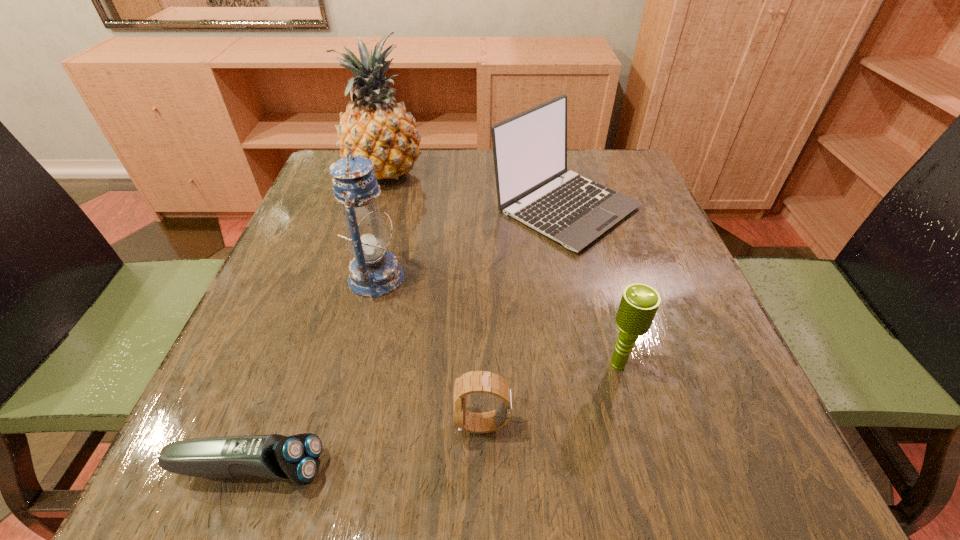
The height and width of the screenshot is (540, 960). In order to click on the tallest object in this screenshot , I will do `click(376, 127)`.

Image resolution: width=960 pixels, height=540 pixels. In order to click on the second tallest object in this screenshot , I will do `click(373, 272)`.

Locate an element on the screen. The height and width of the screenshot is (540, 960). the third tallest object is located at coordinates (533, 186).

Locate an element on the screen. This screenshot has height=540, width=960. the third nearest object is located at coordinates (639, 303).

At what (x,y) coordinates should I click in order to perform the action: click on the fourth tallest object. Please return your answer as a coordinate pair (x, y). The image size is (960, 540). Looking at the image, I should click on (639, 303).

Where is `the fifth tallest object`? the fifth tallest object is located at coordinates (478, 381).

In order to click on watch in this screenshot , I will do `click(478, 381)`.

Where is `the nearest object`? This screenshot has height=540, width=960. the nearest object is located at coordinates (296, 458).

The image size is (960, 540). In order to click on electric shaver in this screenshot , I will do `click(296, 458)`.

Where is `vacant point located on the right of the pineapple`? vacant point located on the right of the pineapple is located at coordinates (518, 172).